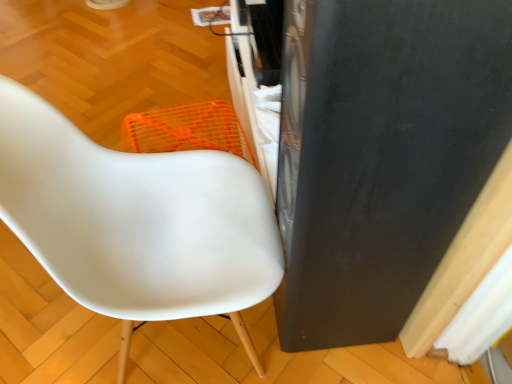
Identify the location of black matte speaker at right. (381, 155).

Describe the element at coordinates (381, 155) in the screenshot. This screenshot has height=384, width=512. I see `black matte speaker at right` at that location.

Locate an element on the screen. The width and height of the screenshot is (512, 384). white matte chair at center is located at coordinates (136, 221).

Describe the element at coordinates (136, 221) in the screenshot. I see `white matte chair at center` at that location.

Measure the distance between point (93, 208) and camera.

The depth of point (93, 208) is 98.80 centimeters.

The image size is (512, 384). I want to click on black matte speaker at right, so click(x=381, y=155).

Which object is positioned more to the left, white matte chair at center or black matte speaker at right?

Positioned to the left is white matte chair at center.

Is white matte chair at center positioned in front of black matte speaker at right?

No, white matte chair at center is further to the viewer.

Which is in front, point (265, 263) or point (486, 125)?

The point (486, 125) is in front.

From the image's perspective, which one is positioned higher, white matte chair at center or black matte speaker at right?

black matte speaker at right is shown above in the image.

From a real-world perspective, between white matte chair at center and black matte speaker at right, who is vertically lower?

In real-world perspective, white matte chair at center is lower.

Looking at this image, considering the sizes of white matte chair at center and black matte speaker at right in the image, is white matte chair at center wider or thinner than black matte speaker at right?

In the image, white matte chair at center appears to be wider than black matte speaker at right.

Does white matte chair at center have a greater height compared to black matte speaker at right?

In fact, white matte chair at center may be shorter than black matte speaker at right.

Who is bigger, white matte chair at center or black matte speaker at right?

white matte chair at center.

Is black matte speaker at right completely or partially inside white matte chair at center?

Actually, black matte speaker at right is outside white matte chair at center.

Can you see white matte chair at center touching black matte speaker at right?

No, white matte chair at center is not touching black matte speaker at right.

Is white matte chair at center aimed at black matte speaker at right?

Yes, white matte chair at center is oriented towards black matte speaker at right.

Looking at this image, can you tell me how much white matte chair at center and black matte speaker at right differ in facing direction?

There is a 179-degree angle between the facing directions of white matte chair at center and black matte speaker at right.

At what (x,y) coordinates should I click in order to perform the action: click on chair below the black matte speaker at right (from a real-world perspective). Please return your answer as a coordinate pair (x, y). The height and width of the screenshot is (384, 512). Looking at the image, I should click on (136, 221).

Considering the relative positions of black matte speaker at right and white matte chair at center in the image provided, is black matte speaker at right to the right of white matte chair at center from the viewer's perspective?

Indeed, black matte speaker at right is positioned on the right side of white matte chair at center.

Who is more distant, black matte speaker at right or white matte chair at center?

white matte chair at center is more distant.

Which point is more distant from viewer, (440, 55) or (23, 117)?

The point (23, 117) is behind.

From the image's perspective, does black matte speaker at right appear lower than white matte chair at center?

Actually, black matte speaker at right appears above white matte chair at center in the image.

From a real-world perspective, which is physically below, black matte speaker at right or white matte chair at center?

From a 3D spatial view, white matte chair at center is below.

Considering the sizes of objects black matte speaker at right and white matte chair at center in the image provided, who is thinner, black matte speaker at right or white matte chair at center?

black matte speaker at right is thinner.

Is black matte speaker at right shorter than white matte chair at center?

In fact, black matte speaker at right may be taller than white matte chair at center.

Which of these two, black matte speaker at right or white matte chair at center, is smaller?

black matte speaker at right.

Could white matte chair at center be considered to be inside black matte speaker at right?

That's incorrect, white matte chair at center is not inside black matte speaker at right.

Would you consider black matte speaker at right to be distant from white matte chair at center?

No, black matte speaker at right is in close proximity to white matte chair at center.

Does black matte speaker at right turn towards white matte chair at center?

Yes, black matte speaker at right faces towards white matte chair at center.

In the scene shown: What's the angular difference between black matte speaker at right and white matte chair at center's facing directions?

The angle between the facing direction of black matte speaker at right and the facing direction of white matte chair at center is 179 degrees.

Measure the distance between black matte speaker at right and white matte chair at center.

black matte speaker at right is 13.42 inches from white matte chair at center.

Where is `chair to the left of black matte speaker at right`? The height and width of the screenshot is (384, 512). chair to the left of black matte speaker at right is located at coordinates (136, 221).

At what (x,y) coordinates should I click in order to perform the action: click on chair beneath the black matte speaker at right (from a real-world perspective). Please return your answer as a coordinate pair (x, y). The image size is (512, 384). Looking at the image, I should click on (136, 221).

At what (x,y) coordinates should I click in order to perform the action: click on appliance above the white matte chair at center (from a real-world perspective). Please return your answer as a coordinate pair (x, y). This screenshot has width=512, height=384. Looking at the image, I should click on (381, 155).